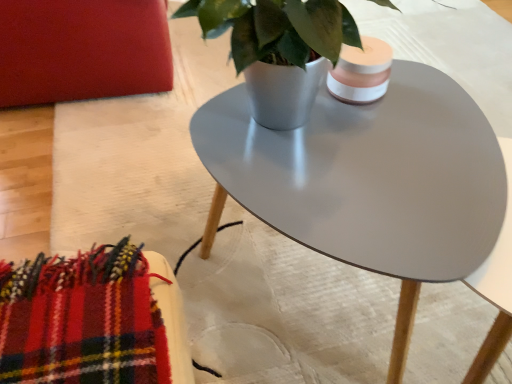
Question: From the image's perspective, is matte red armchair at upper left on matte gray pot at center?

Choices:
 (A) yes
 (B) no

Answer: (A)

Question: Does matte red armchair at upper left have a greater width compared to matte gray pot at center?

Choices:
 (A) no
 (B) yes

Answer: (B)

Question: From the image's perspective, is matte red armchair at upper left beneath matte gray pot at center?

Choices:
 (A) no
 (B) yes

Answer: (A)

Question: Does matte red armchair at upper left appear on the left side of matte gray pot at center?

Choices:
 (A) no
 (B) yes

Answer: (B)

Question: Considering the relative positions of matte red armchair at upper left and matte gray pot at center in the image provided, is matte red armchair at upper left to the right of matte gray pot at center from the viewer's perspective?

Choices:
 (A) yes
 (B) no

Answer: (B)

Question: Is matte red armchair at upper left next to matte gray pot at center?

Choices:
 (A) yes
 (B) no

Answer: (B)

Question: Is matte gray coffee table at center turned away from matte red armchair at upper left?

Choices:
 (A) no
 (B) yes

Answer: (A)

Question: Can you confirm if matte gray coffee table at center is positioned to the right of matte red armchair at upper left?

Choices:
 (A) no
 (B) yes

Answer: (B)

Question: Is matte gray coffee table at center facing towards matte red armchair at upper left?

Choices:
 (A) no
 (B) yes

Answer: (B)

Question: Is matte gray coffee table at center beside matte red armchair at upper left?

Choices:
 (A) yes
 (B) no

Answer: (B)

Question: Is matte gray coffee table at center at the left side of matte red armchair at upper left?

Choices:
 (A) no
 (B) yes

Answer: (A)

Question: Is matte gray coffee table at center located outside matte red armchair at upper left?

Choices:
 (A) no
 (B) yes

Answer: (B)

Question: Does matte gray pot at center have a greater width compared to matte gray coffee table at center?

Choices:
 (A) no
 (B) yes

Answer: (A)